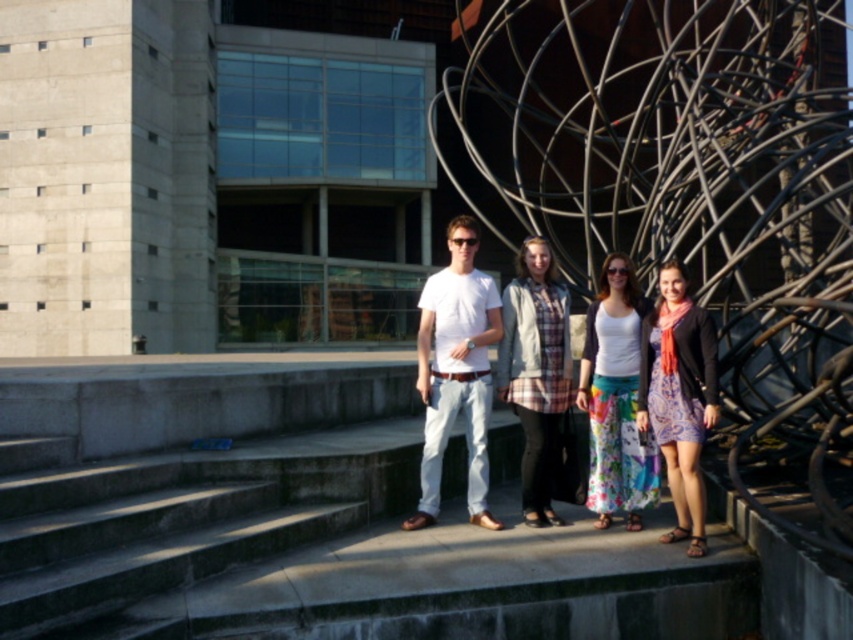
Question: Is white cotton tank top at center smaller than patterned fabric dress at center?

Choices:
 (A) no
 (B) yes

Answer: (A)

Question: Is white cotton tank top at center positioned before plaid fabric shirt at center?

Choices:
 (A) no
 (B) yes

Answer: (B)

Question: Which point is closer to the camera taking this photo?

Choices:
 (A) (706, 346)
 (B) (524, 461)

Answer: (A)

Question: Based on their relative distances, which object is farther from the plaid fabric shirt at center?

Choices:
 (A) white cotton tank top at center
 (B) patterned fabric dress at center

Answer: (B)

Question: Which object is closer to the camera taking this photo?

Choices:
 (A) white cotton tank top at center
 (B) plaid fabric shirt at center

Answer: (A)

Question: From the image, what is the correct spatial relationship of white cotton tank top at center in relation to plaid fabric shirt at center?

Choices:
 (A) below
 (B) above

Answer: (A)